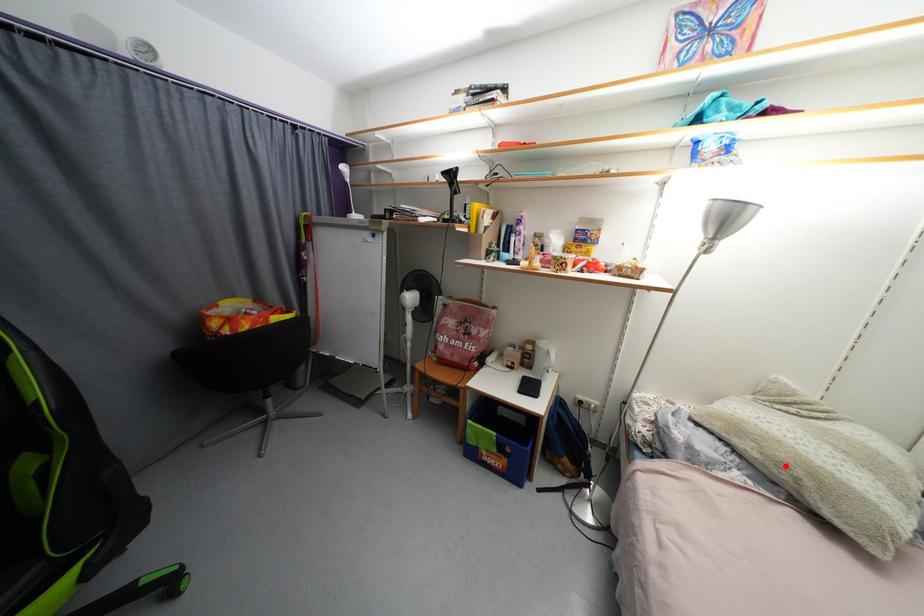
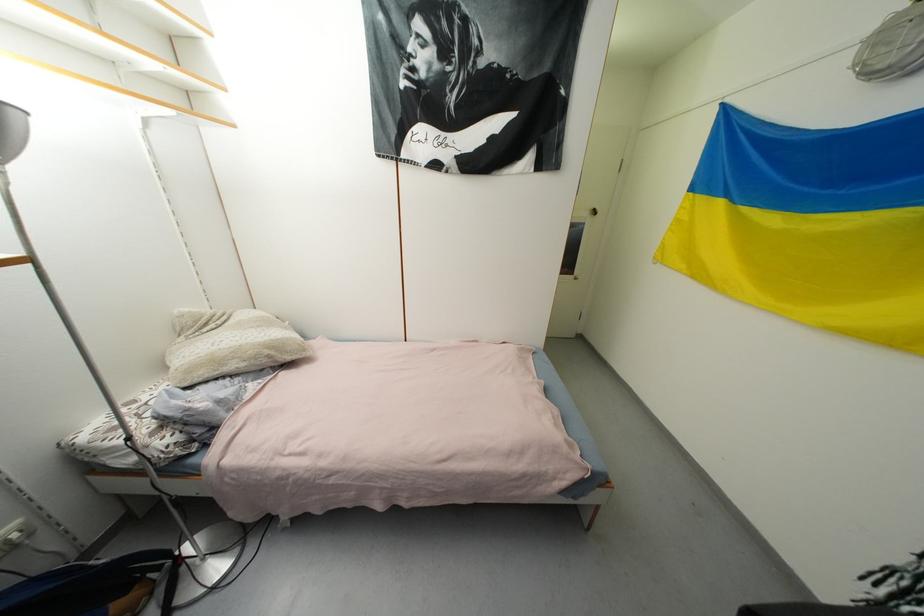
Question: I am providing you with two images of the same scene from different viewpoints. Given a red point in image1, look at the same physical point in image2. Is it:

Choices:
 (A) Closer to the viewpoint
 (B) Farther from the viewpoint

Answer: (A)